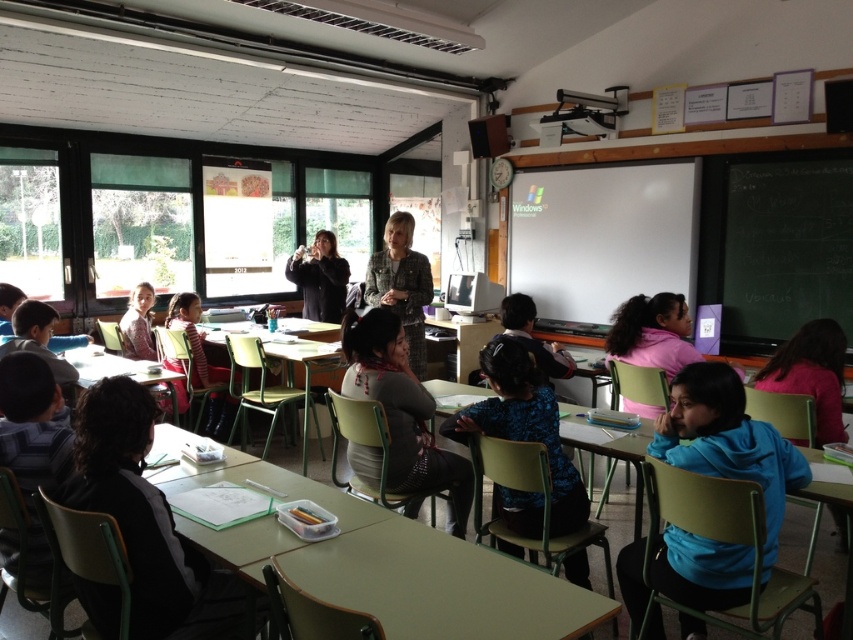
Does blackboard at right lie in front of patterned fabric jacket at center?

No, blackboard at right is further to the viewer.

Is blackboard at right bigger than patterned fabric jacket at center?

Correct, blackboard at right is larger in size than patterned fabric jacket at center.

Find the location of a particular element. The height and width of the screenshot is (640, 853). blackboard at right is located at coordinates (778, 250).

Does green plastic table at center come behind patterned fabric jacket at center?

That is False.

Is point (244, 394) positioned in front of point (407, 289)?

That is False.

What do you see at coordinates (283, 376) in the screenshot? This screenshot has height=640, width=853. I see `green plastic table at center` at bounding box center [283, 376].

Locate an element on the screen. This screenshot has width=853, height=640. green plastic table at center is located at coordinates (283, 376).

Who is lower down, blue fleece jacket at lower right or green plastic table at center?

Positioned lower is blue fleece jacket at lower right.

Image resolution: width=853 pixels, height=640 pixels. What do you see at coordinates (728, 442) in the screenshot?
I see `blue fleece jacket at lower right` at bounding box center [728, 442].

I want to click on blue fleece jacket at lower right, so click(x=728, y=442).